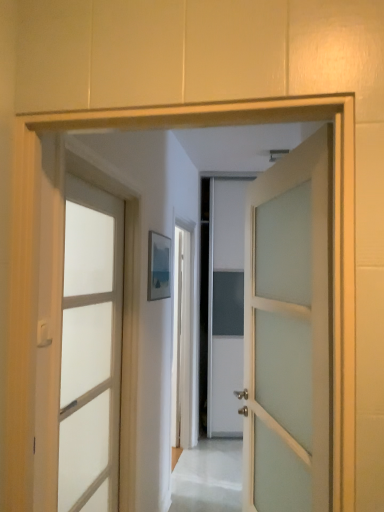
What do you see at coordinates (290, 332) in the screenshot? The image size is (384, 512). I see `white frosted glass door at center, which is the 1th door in right-to-left order` at bounding box center [290, 332].

Where is `white frosted glass door at center, the second door viewed from the left`? white frosted glass door at center, the second door viewed from the left is located at coordinates (290, 332).

Does point (108, 459) appear closer or farther from the camera than point (46, 342)?

Point (108, 459).

Could you tell me if translucent glass door at center, the 1th door from the left, is facing matte white door handle at left?

No, translucent glass door at center, the 1th door from the left, does not turn towards matte white door handle at left.

Is translucent glass door at center, the 1th door from the left, not near matte white door handle at left?

No, there isn't a large distance between translucent glass door at center, the 1th door from the left, and matte white door handle at left.

How much distance is there between translucent glass door at center, which is the second door in right-to-left order, and matte white door handle at left?

translucent glass door at center, which is the second door in right-to-left order, and matte white door handle at left are 27.58 inches apart.

Is white frosted glass door at center, the second door viewed from the left, far away from matte white door handle at left?

No, there isn't a large distance between white frosted glass door at center, the second door viewed from the left, and matte white door handle at left.

Is point (263, 204) behind point (45, 320)?

Yes, it is.

From a real-world perspective, which object stands above the other?

matte white door handle at left.

From a real-world perspective, is matte white door handle at left positioned above or below white frosted glass door at center, which is the 1th door in right-to-left order?

In terms of real-world spatial position, matte white door handle at left is above white frosted glass door at center, which is the 1th door in right-to-left order.

Could you tell me if matte white door handle at left is turned towards white frosted glass door at center, the second door viewed from the left?

Yes, matte white door handle at left is aimed at white frosted glass door at center, the second door viewed from the left.

Is matte white door handle at left shorter than white frosted glass door at center, the second door viewed from the left?

Indeed, matte white door handle at left has a lesser height compared to white frosted glass door at center, the second door viewed from the left.

Looking at this image, from the image's perspective, is matte white door handle at left located above or below white frosted glass door at center, the second door viewed from the left?

From the image's perspective, matte white door handle at left appears above white frosted glass door at center, the second door viewed from the left.

Is point (80, 291) positioned behind point (309, 167)?

Yes, point (80, 291) is farther from viewer.

Is translucent glass door at center, which is the second door in right-to-left order, turned away from white frosted glass door at center, the second door viewed from the left?

translucent glass door at center, which is the second door in right-to-left order, is not turned away from white frosted glass door at center, the second door viewed from the left.

Identify the location of door located above the translucent glass door at center, which is the second door in right-to-left order (from the image's perspective). This screenshot has height=512, width=384. (290, 332).

From the image's perspective, is translucent glass door at center, which is the second door in right-to-left order, under white frosted glass door at center, which is the 1th door in right-to-left order?

Yes, from the image's perspective, translucent glass door at center, which is the second door in right-to-left order, is beneath white frosted glass door at center, which is the 1th door in right-to-left order.

Considering the sizes of objects matte white door handle at left and translucent glass door at center, the 1th door from the left, in the image provided, who is smaller, matte white door handle at left or translucent glass door at center, the 1th door from the left,?

matte white door handle at left.

Consider the image. Can you confirm if matte white door handle at left is wider than translucent glass door at center, the 1th door from the left?

No, matte white door handle at left is not wider than translucent glass door at center, the 1th door from the left.

Considering the relative sizes of matte white door handle at left and translucent glass door at center, the 1th door from the left, in the image provided, is matte white door handle at left taller than translucent glass door at center, the 1th door from the left,?

Incorrect, the height of matte white door handle at left is not larger of that of translucent glass door at center, the 1th door from the left.

From a real-world perspective, is matte white door handle at left below translucent glass door at center, which is the second door in right-to-left order?

No, from a real-world perspective, matte white door handle at left is not under translucent glass door at center, which is the second door in right-to-left order.

Is white frosted glass door at center, which is the 1th door in right-to-left order, oriented towards translucent glass door at center, which is the second door in right-to-left order?

Yes, white frosted glass door at center, which is the 1th door in right-to-left order, is facing translucent glass door at center, which is the second door in right-to-left order.

Can we say white frosted glass door at center, which is the 1th door in right-to-left order, lies outside translucent glass door at center, which is the second door in right-to-left order?

Yes, white frosted glass door at center, which is the 1th door in right-to-left order, is not within translucent glass door at center, which is the second door in right-to-left order.

Could you measure the distance between white frosted glass door at center, the second door viewed from the left, and translucent glass door at center, the 1th door from the left?

white frosted glass door at center, the second door viewed from the left, and translucent glass door at center, the 1th door from the left, are 30.08 inches apart.

In the scene shown: From the image's perspective, is white frosted glass door at center, the second door viewed from the left, beneath translucent glass door at center, the 1th door from the left?

No.

Find the location of a particular element. The image size is (384, 512). the 1st door counting from the right side of the matte white door handle at left is located at coordinates (90, 350).

Find the location of a particular element. This screenshot has height=512, width=384. door handle positioned vertically above the white frosted glass door at center, the second door viewed from the left (from a real-world perspective) is located at coordinates (43, 333).

Which object lies further to the anchor point translucent glass door at center, the 1th door from the left, white frosted glass door at center, the second door viewed from the left, or matte white door handle at left?

white frosted glass door at center, the second door viewed from the left, is further to translucent glass door at center, the 1th door from the left.

Which object lies nearer to the anchor point translucent glass door at center, which is the second door in right-to-left order, matte white door handle at left or white frosted glass door at center, the second door viewed from the left?

matte white door handle at left is positioned closer to the anchor translucent glass door at center, which is the second door in right-to-left order.

Estimate the real-world distances between objects in this image. Which object is further from matte white door handle at left, white frosted glass door at center, the second door viewed from the left, or translucent glass door at center, which is the second door in right-to-left order?

white frosted glass door at center, the second door viewed from the left.

When comparing their distances from white frosted glass door at center, which is the 1th door in right-to-left order, does matte white door handle at left or translucent glass door at center, the 1th door from the left, seem further?

matte white door handle at left.

When comparing their distances from matte white door handle at left, does translucent glass door at center, which is the second door in right-to-left order, or white frosted glass door at center, which is the 1th door in right-to-left order, seem further?

Based on the image, white frosted glass door at center, which is the 1th door in right-to-left order, appears to be further to matte white door handle at left.

When comparing their distances from white frosted glass door at center, which is the 1th door in right-to-left order, does translucent glass door at center, the 1th door from the left, or matte white door handle at left seem further?

matte white door handle at left is further to white frosted glass door at center, which is the 1th door in right-to-left order.

At what (x,y) coordinates should I click in order to perform the action: click on door between matte white door handle at left and white frosted glass door at center, which is the 1th door in right-to-left order, from left to right. Please return your answer as a coordinate pair (x, y). Looking at the image, I should click on (90, 350).